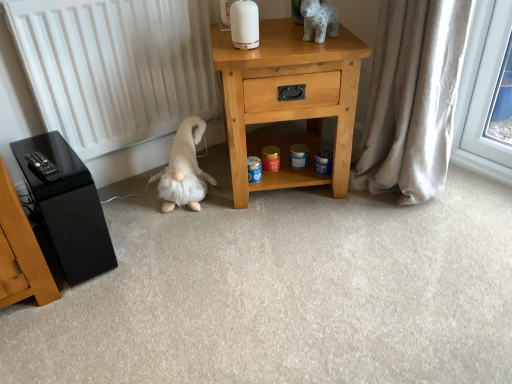
Image resolution: width=512 pixels, height=384 pixels. What are the coordinates of `unoccupied region to the right of fluffy white plush at lower left, which ranks as the 1th animal in bottom-to-top order` in the screenshot? It's located at (236, 203).